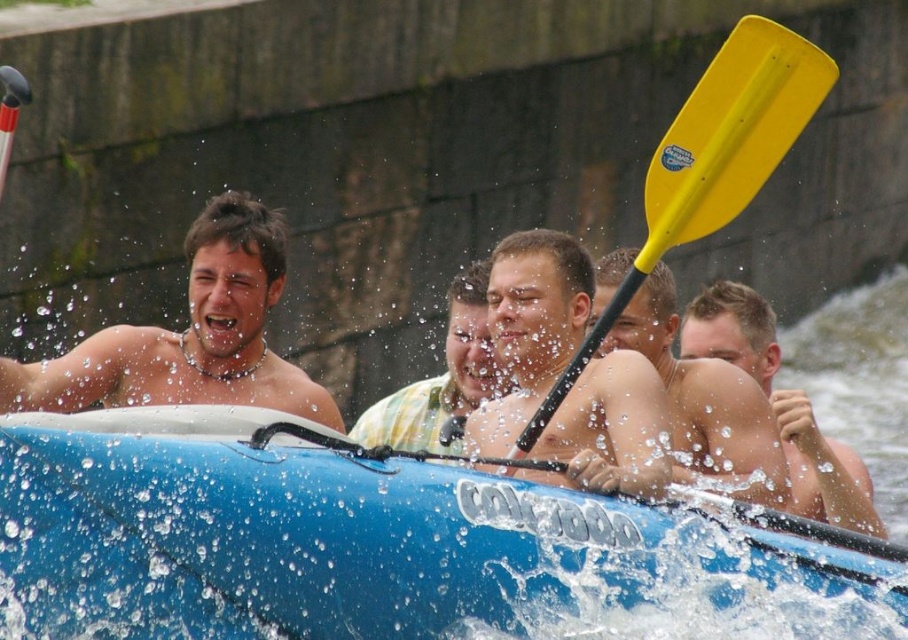
Which of these two, shiny silver necklace at left or smooth skin face at center, stands shorter?

smooth skin face at center is shorter.

The image size is (908, 640). I want to click on shiny silver necklace at left, so click(x=189, y=336).

Between point (652, 342) and point (395, 428), which one is positioned behind?

Point (395, 428)

Measure the distance between point (666, 380) and camera.

The distance of point (666, 380) from camera is 50.60 meters.

Locate an element on the screen. smooth skin torso at center is located at coordinates point(706,403).

Which is above, yellow plastic paddle at center or smooth skin torso at center?

yellow plastic paddle at center is above.

Can you confirm if yellow plastic paddle at center is shorter than smooth skin torso at center?

No.

Which is behind, point (721, 84) or point (703, 474)?

Positioned behind is point (703, 474).

This screenshot has width=908, height=640. In order to click on yellow plastic paddle at center in this screenshot , I will do `click(709, 164)`.